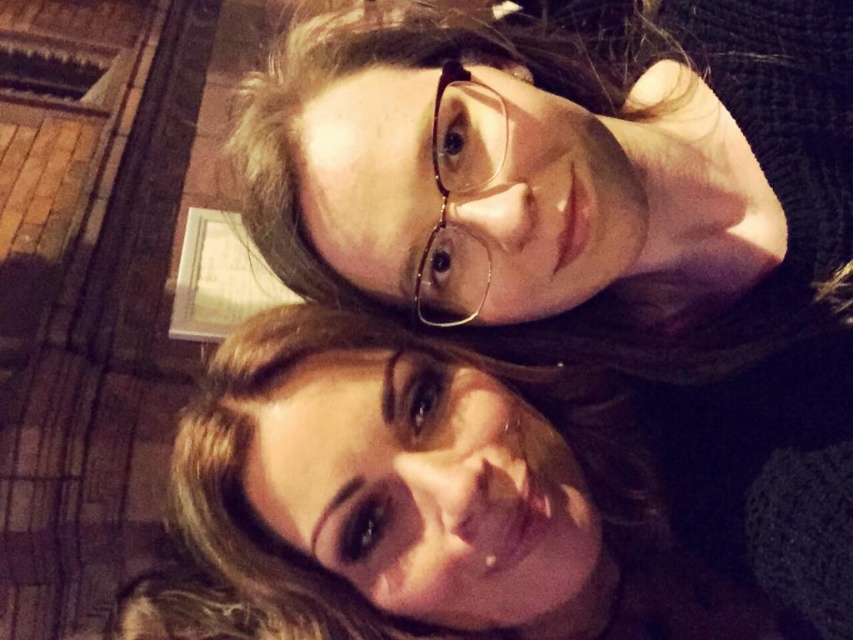
Does smooth brown hair at center have a greater width compared to clear plastic glasses at center?

Correct, the width of smooth brown hair at center exceeds that of clear plastic glasses at center.

What do you see at coordinates (416, 500) in the screenshot?
I see `smooth brown hair at center` at bounding box center [416, 500].

Find the location of a particular element. smooth brown hair at center is located at coordinates (416, 500).

Who is higher up, matte black glasses at upper center or clear plastic glasses at center?

matte black glasses at upper center is higher up.

Is matte black glasses at upper center further to the viewer compared to clear plastic glasses at center?

That is False.

Is point (287, 90) farther from viewer compared to point (440, 70)?

Yes, it is.

This screenshot has height=640, width=853. I want to click on matte black glasses at upper center, so click(x=521, y=196).

Is matte black glasses at upper center smaller than smooth brown hair at center?

Correct, matte black glasses at upper center occupies less space than smooth brown hair at center.

Can you confirm if matte black glasses at upper center is thinner than smooth brown hair at center?

Correct, matte black glasses at upper center's width is less than smooth brown hair at center's.

Is point (422, 108) positioned in front of point (320, 518)?

Yes, it is.

Identify the location of matte black glasses at upper center. (521, 196).